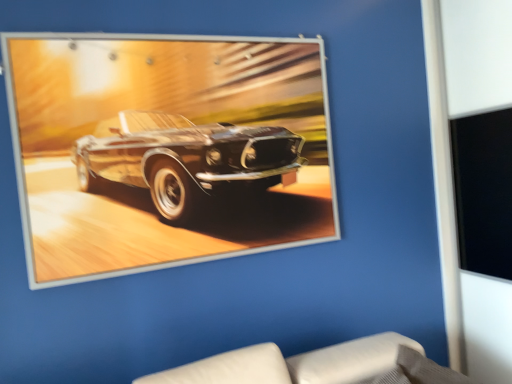
Locate an element on the screen. This screenshot has height=384, width=512. metallic silver picture frame at upper center is located at coordinates (166, 149).

Describe the element at coordinates (166, 149) in the screenshot. Image resolution: width=512 pixels, height=384 pixels. I see `metallic silver picture frame at upper center` at that location.

What is the approximate height of metallic silver picture frame at upper center?

3.37 feet.

Measure the distance between point (19, 34) and camera.

Point (19, 34) and camera are 1.65 meters apart.

At what (x,y) coordinates should I click in order to perform the action: click on metallic silver picture frame at upper center. Please return your answer as a coordinate pair (x, y). This screenshot has width=512, height=384. Looking at the image, I should click on (166, 149).